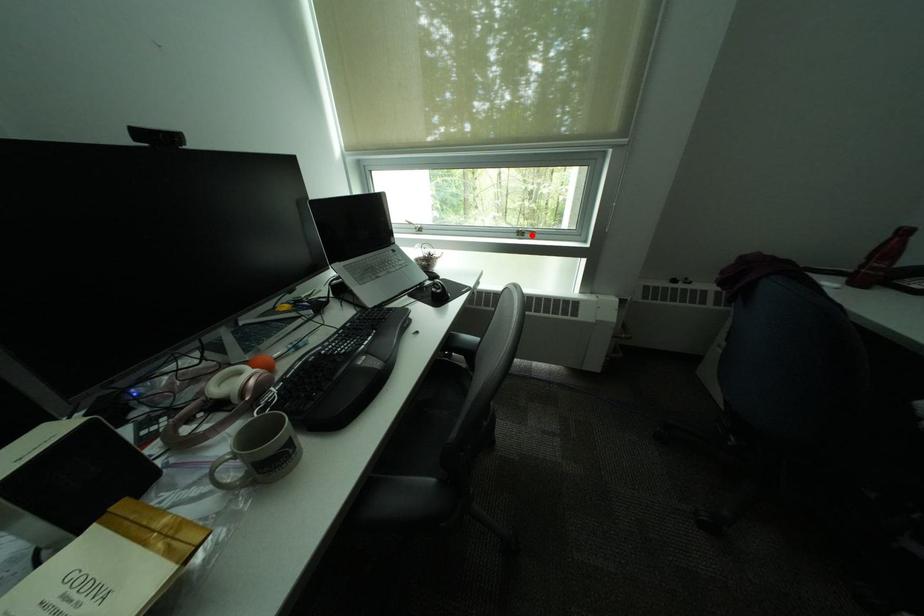
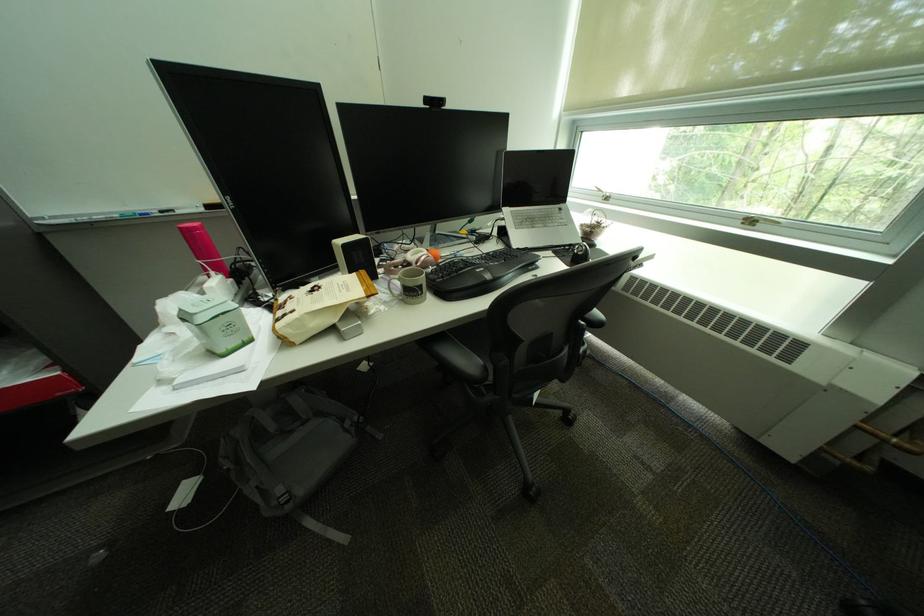
Find the pixel in the second image that matches the highlighted location in the first image.

(761, 224)